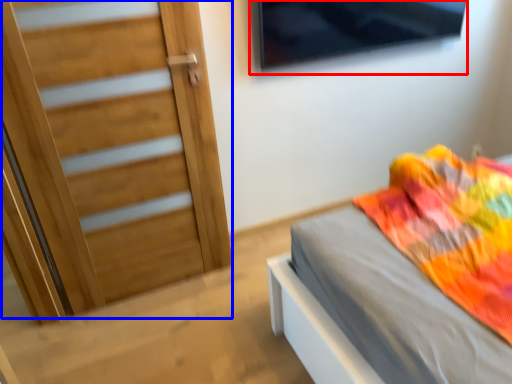
Question: Among these objects, which one is nearest to the camera, window (highlighted by a red box) or door (highlighted by a blue box)?

Choices:
 (A) window
 (B) door

Answer: (B)